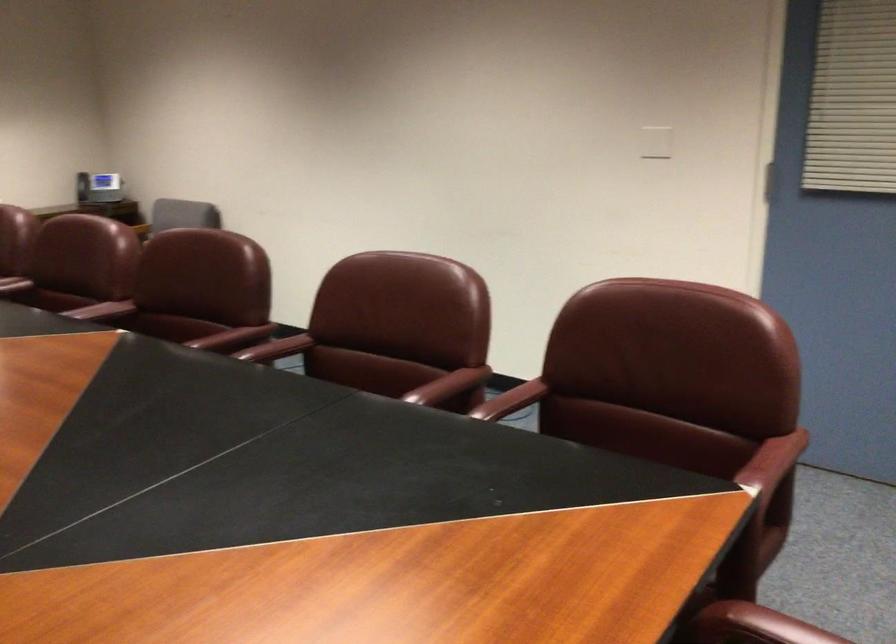
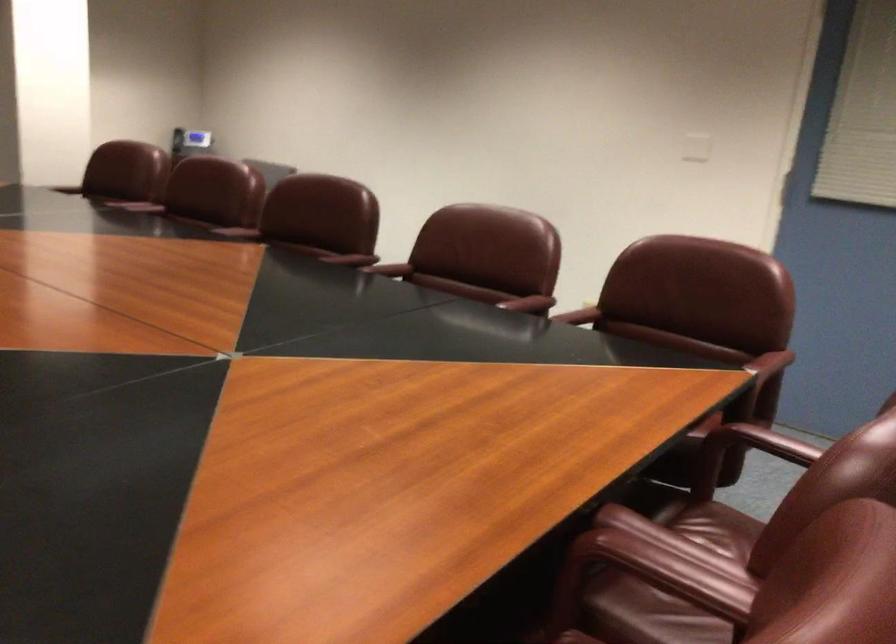
Locate, in the second image, the point that corresponds to point 764,455 in the first image.

(769, 362)